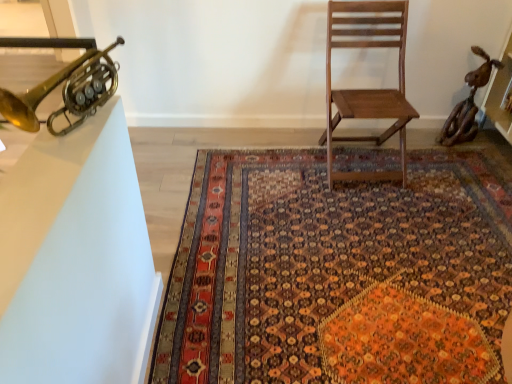
Question: From a real-world perspective, is white glossy table at left physically below carpet with intricate patterns at center?

Choices:
 (A) no
 (B) yes

Answer: (A)

Question: Can you see white glossy table at left touching carpet with intricate patterns at center?

Choices:
 (A) yes
 (B) no

Answer: (B)

Question: From a real-world perspective, is white glossy table at left located higher than carpet with intricate patterns at center?

Choices:
 (A) no
 (B) yes

Answer: (B)

Question: Considering the relative sizes of white glossy table at left and carpet with intricate patterns at center in the image provided, is white glossy table at left bigger than carpet with intricate patterns at center?

Choices:
 (A) no
 (B) yes

Answer: (A)

Question: From the image's perspective, is white glossy table at left over carpet with intricate patterns at center?

Choices:
 (A) no
 (B) yes

Answer: (B)

Question: From a real-world perspective, is gold brass trumpet at upper left physically located above or below carpet with intricate patterns at center?

Choices:
 (A) above
 (B) below

Answer: (A)

Question: Is gold brass trumpet at upper left taller or shorter than carpet with intricate patterns at center?

Choices:
 (A) tall
 (B) short

Answer: (A)

Question: In terms of size, does gold brass trumpet at upper left appear bigger or smaller than carpet with intricate patterns at center?

Choices:
 (A) small
 (B) big

Answer: (A)

Question: Is gold brass trumpet at upper left in front of or behind carpet with intricate patterns at center in the image?

Choices:
 (A) behind
 (B) front

Answer: (B)

Question: Considering the positions of wooden chair at center and white glossy table at left in the image, is wooden chair at center bigger or smaller than white glossy table at left?

Choices:
 (A) big
 (B) small

Answer: (A)

Question: From their relative heights in the image, would you say wooden chair at center is taller or shorter than white glossy table at left?

Choices:
 (A) tall
 (B) short

Answer: (A)

Question: Relative to white glossy table at left, is wooden chair at center in front or behind?

Choices:
 (A) front
 (B) behind

Answer: (B)

Question: In terms of width, does wooden chair at center look wider or thinner when compared to white glossy table at left?

Choices:
 (A) thin
 (B) wide

Answer: (B)

Question: From a real-world perspective, relative to gold brass trumpet at upper left, is white glossy table at left vertically above or below?

Choices:
 (A) below
 (B) above

Answer: (A)

Question: Do you think white glossy table at left is within gold brass trumpet at upper left, or outside of it?

Choices:
 (A) inside
 (B) outside

Answer: (B)